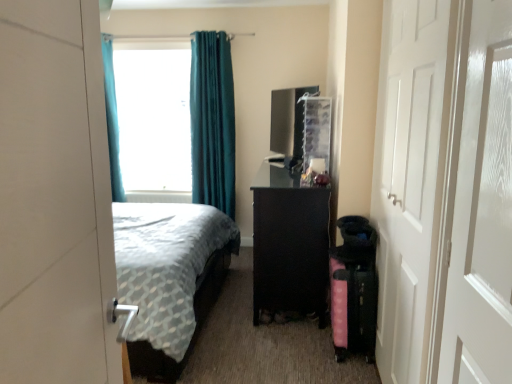
Question: Are pink fabric suitcase at lower right and transparent frosted glass screen door at right far apart?

Choices:
 (A) yes
 (B) no

Answer: (A)

Question: Does pink fabric suitcase at lower right have a larger size compared to transparent frosted glass screen door at right?

Choices:
 (A) yes
 (B) no

Answer: (A)

Question: Does pink fabric suitcase at lower right appear on the left side of transparent frosted glass screen door at right?

Choices:
 (A) no
 (B) yes

Answer: (B)

Question: From the image's perspective, is pink fabric suitcase at lower right under transparent frosted glass screen door at right?

Choices:
 (A) yes
 (B) no

Answer: (A)

Question: Considering the relative sizes of pink fabric suitcase at lower right and transparent frosted glass screen door at right in the image provided, is pink fabric suitcase at lower right thinner than transparent frosted glass screen door at right?

Choices:
 (A) yes
 (B) no

Answer: (B)

Question: Considering the positions of white glossy door at left, acting as the 2th door starting from the back, and transparent frosted glass screen door at right in the image, is white glossy door at left, acting as the 2th door starting from the back, bigger or smaller than transparent frosted glass screen door at right?

Choices:
 (A) small
 (B) big

Answer: (B)

Question: Considering the positions of point (45, 306) and point (451, 359), is point (45, 306) closer or farther from the camera than point (451, 359)?

Choices:
 (A) farther
 (B) closer

Answer: (B)

Question: Is white glossy door at left, the second door in the right-to-left sequence, in front of or behind transparent frosted glass screen door at right in the image?

Choices:
 (A) front
 (B) behind

Answer: (A)

Question: In terms of width, does white glossy door at left, which appears as the first door when viewed from the front, look wider or thinner when compared to transparent frosted glass screen door at right?

Choices:
 (A) thin
 (B) wide

Answer: (B)

Question: Is teal velvet curtain at upper center, the 1th curtain viewed from the right, inside the boundaries of black glossy vanity at center, or outside?

Choices:
 (A) outside
 (B) inside

Answer: (A)

Question: Considering the positions of teal velvet curtain at upper center, the 1th curtain viewed from the right, and black glossy vanity at center in the image, is teal velvet curtain at upper center, the 1th curtain viewed from the right, wider or thinner than black glossy vanity at center?

Choices:
 (A) thin
 (B) wide

Answer: (A)

Question: From the image's perspective, is teal velvet curtain at upper center, which is the 2th curtain from left to right, positioned above or below black glossy vanity at center?

Choices:
 (A) below
 (B) above

Answer: (B)

Question: In the image, is teal velvet curtain at upper center, which is the 2th curtain from left to right, on the left side or the right side of black glossy vanity at center?

Choices:
 (A) right
 (B) left

Answer: (B)

Question: Is point (195, 112) closer or farther from the camera than point (441, 119)?

Choices:
 (A) farther
 (B) closer

Answer: (A)

Question: In the image, is teal velvet curtain at upper center, the 1th curtain viewed from the right, positioned in front of or behind white matte door at right, which ranks as the 1th door in back-to-front order?

Choices:
 (A) behind
 (B) front

Answer: (A)